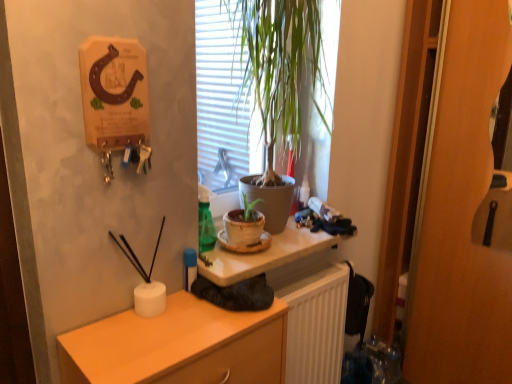
Question: Is green leafy plant at center far from matte white desk at center?

Choices:
 (A) yes
 (B) no

Answer: (B)

Question: From a real-world perspective, is green leafy plant at center located higher than matte white desk at center?

Choices:
 (A) no
 (B) yes

Answer: (B)

Question: Considering the relative sizes of green leafy plant at center and matte white desk at center in the image provided, is green leafy plant at center thinner than matte white desk at center?

Choices:
 (A) yes
 (B) no

Answer: (A)

Question: Are green leafy plant at center and matte white desk at center beside each other?

Choices:
 (A) no
 (B) yes

Answer: (A)

Question: Does green leafy plant at center have a smaller size compared to matte white desk at center?

Choices:
 (A) no
 (B) yes

Answer: (A)

Question: Is green leafy plant at center behind matte white desk at center?

Choices:
 (A) no
 (B) yes

Answer: (A)

Question: Is white ribbed radiator at lower center taller than matte orange cabinet at lower left?

Choices:
 (A) no
 (B) yes

Answer: (B)

Question: Can you confirm if white ribbed radiator at lower center is thinner than matte orange cabinet at lower left?

Choices:
 (A) no
 (B) yes

Answer: (B)

Question: Is the position of white ribbed radiator at lower center more distant than that of matte orange cabinet at lower left?

Choices:
 (A) no
 (B) yes

Answer: (B)

Question: From a real-world perspective, is white ribbed radiator at lower center located beneath matte orange cabinet at lower left?

Choices:
 (A) yes
 (B) no

Answer: (A)

Question: Could you tell me if white ribbed radiator at lower center is facing matte orange cabinet at lower left?

Choices:
 (A) yes
 (B) no

Answer: (B)

Question: Does white ribbed radiator at lower center come in front of matte orange cabinet at lower left?

Choices:
 (A) yes
 (B) no

Answer: (B)

Question: Are matte orange cabinet at lower left and matte white desk at center far apart?

Choices:
 (A) yes
 (B) no

Answer: (B)